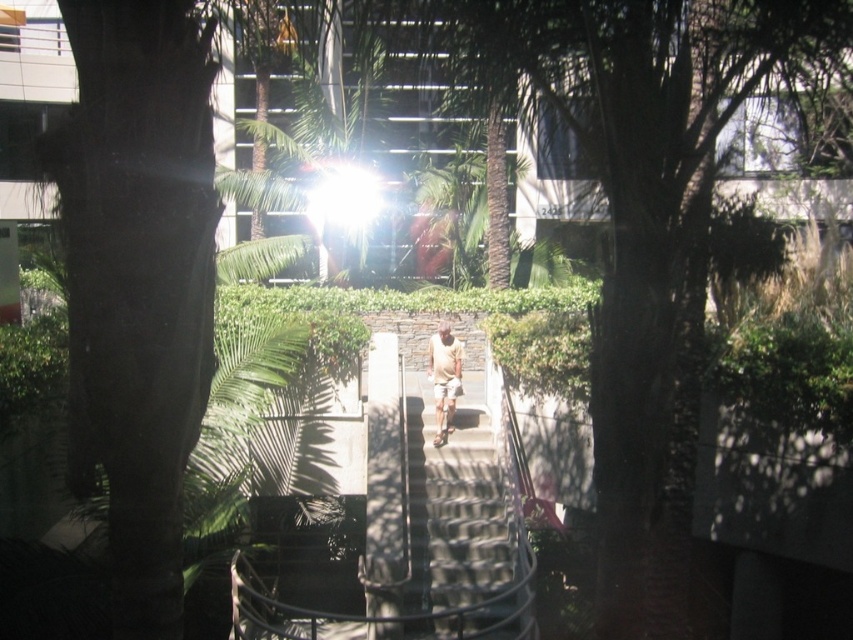
Question: Is smooth concrete stairs at center smaller than light brown shorts at center?

Choices:
 (A) no
 (B) yes

Answer: (A)

Question: Does smooth concrete stairs at center have a greater width compared to light brown shorts at center?

Choices:
 (A) yes
 (B) no

Answer: (A)

Question: Is smooth concrete stairs at center thinner than light brown shorts at center?

Choices:
 (A) yes
 (B) no

Answer: (B)

Question: Which object is closer to the camera taking this photo?

Choices:
 (A) smooth concrete stairs at center
 (B) light brown shorts at center

Answer: (A)